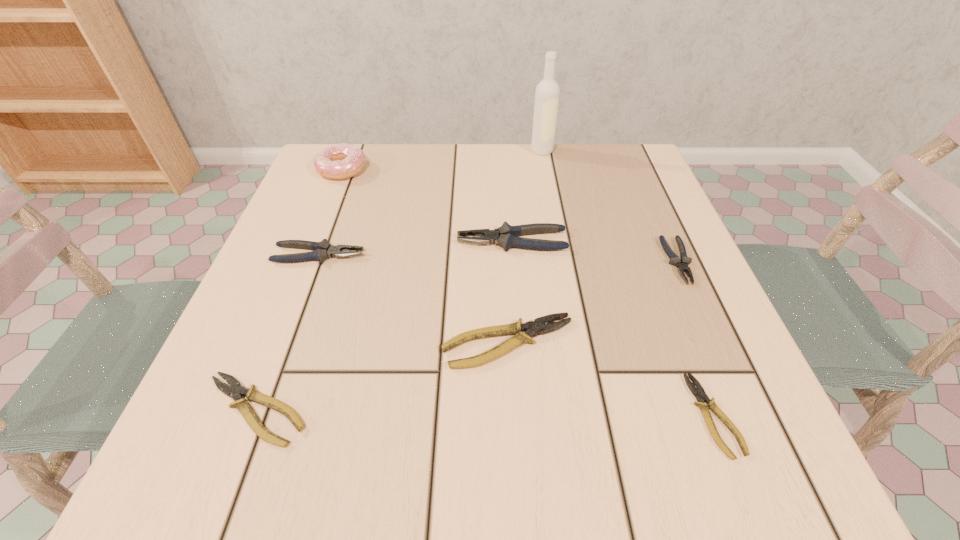
The image size is (960, 540). What are the coordinates of `free space located at the gripping part of the second smallest gray pliers` in the screenshot? It's located at (551, 255).

At what (x,y) coordinates should I click in order to perform the action: click on free space located 0.100m on the front of the sixth farthest object. Please return your answer as a coordinate pair (x, y). The image size is (960, 540). Looking at the image, I should click on [x=513, y=437].

Where is `free space located at the gripping part of the rightmost gray pliers`? free space located at the gripping part of the rightmost gray pliers is located at coordinates (730, 377).

Find the location of a particular element. vacant space located on the back of the second biggest yellow pliers is located at coordinates (332, 208).

Locate an element on the screen. This screenshot has height=540, width=960. free location located 0.350m on the back of the smallest yellow pliers is located at coordinates 638,223.

What are the coordinates of `vodka that is at the far edge` in the screenshot? It's located at (547, 93).

At what (x,y) coordinates should I click in order to perform the action: click on doughnut that is at the far edge. Please return your answer as a coordinate pair (x, y). The width and height of the screenshot is (960, 540). Looking at the image, I should click on (340, 161).

I want to click on doughnut at the left edge, so click(x=340, y=161).

Where is `object that is at the far left corner`? The width and height of the screenshot is (960, 540). object that is at the far left corner is located at coordinates (340, 161).

In order to click on object present at the near left corner in this screenshot , I will do `click(234, 391)`.